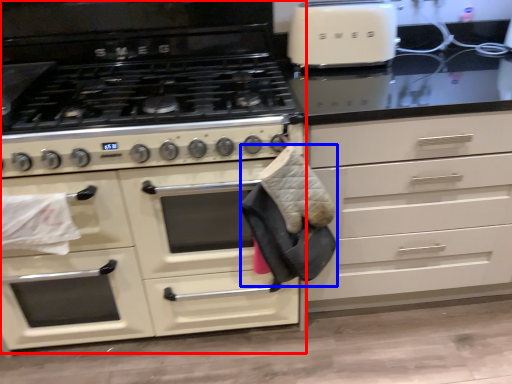
Question: Which point is closer to the camera, cabinetry (highlighted by a red box) or material (highlighted by a blue box)?

Choices:
 (A) cabinetry
 (B) material

Answer: (B)